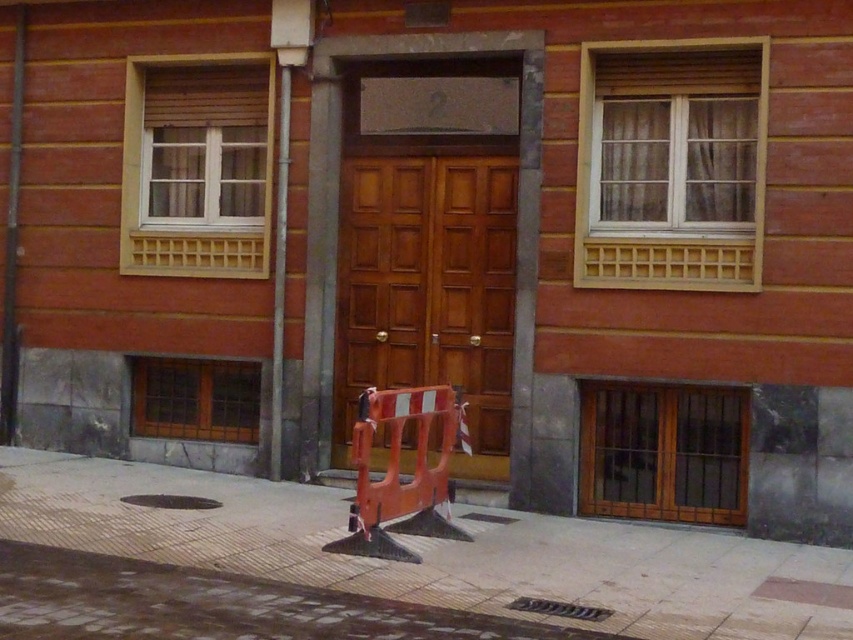
Which is below, smooth concrete pavement at center or wooden at center?

smooth concrete pavement at center

Is smooth concrete pavement at center above wooden at center?

No.

Which is behind, point (721, 541) or point (341, 244)?

The point (341, 244) is behind.

Where is `smooth concrete pavement at center`? Image resolution: width=853 pixels, height=640 pixels. smooth concrete pavement at center is located at coordinates (432, 552).

Is point (288, 516) farther from viewer compared to point (428, 428)?

Yes, point (288, 516) is behind point (428, 428).

Can you confirm if smooth concrete pavement at center is positioned below orange plastic barricade at center?

Indeed, smooth concrete pavement at center is positioned under orange plastic barricade at center.

I want to click on smooth concrete pavement at center, so click(432, 552).

You are a GUI agent. You are given a task and a screenshot of the screen. Output one action in this format:
    pyautogui.click(x=<x>, y=<y>)
    Task: Click on the smooth concrete pavement at center
    The image size is (853, 640).
    Given the screenshot: What is the action you would take?
    pyautogui.click(x=432, y=552)

Can you confirm if wooden at center is smaller than metallic gray pole at left?

No.

Who is more forward, (498, 419) or (276, 234)?

Point (498, 419)

Identify the location of wooden at center. This screenshot has height=640, width=853. (428, 282).